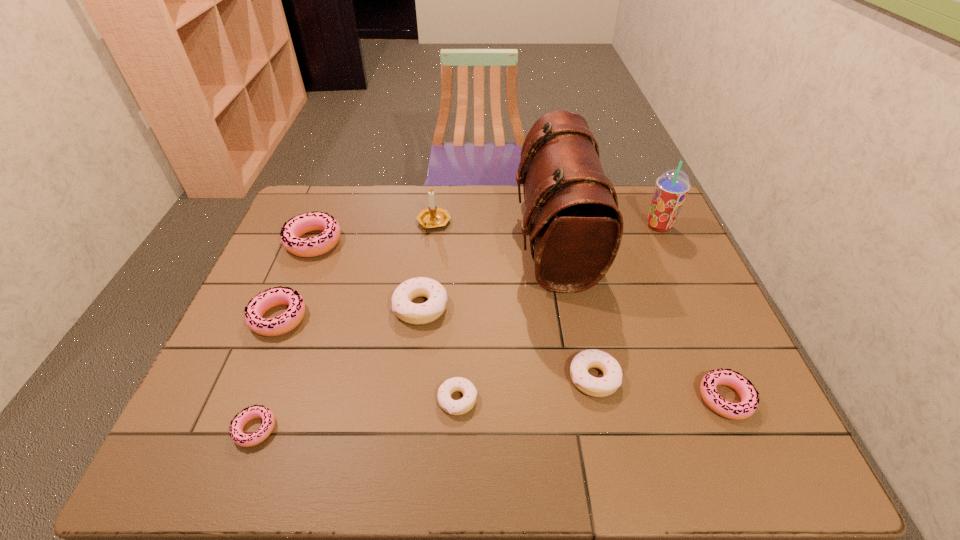
The image size is (960, 540). I want to click on the fourth closest doughnut relative to the rightmost pink doughnut, so click(x=256, y=411).

Identify the location of the fourth closest doughnut to the farthest doughnut. The image size is (960, 540). (454, 407).

In order to click on pink doughnut that is the closest to the farthest doughnut in this screenshot , I will do `click(260, 304)`.

Select which pink doughnut is the third closest to the second biggest pink doughnut. Please provide its 2D coordinates. Your answer should be formatted as a tuple, i.e. [(x, y)], where the tuple contains the x and y coordinates of a point satisfying the conditions above.

[(749, 402)]

Identify which white doughnut is the third nearest to the smallest pink doughnut. Please provide its 2D coordinates. Your answer should be formatted as a tuple, i.e. [(x, y)], where the tuple contains the x and y coordinates of a point satisfying the conditions above.

[(597, 387)]

Point out which white doughnut is positioned as the nearest to the eighth shortest object. Please provide its 2D coordinates. Your answer should be formatted as a tuple, i.e. [(x, y)], where the tuple contains the x and y coordinates of a point satisfying the conditions above.

[(417, 314)]

Locate an element on the screen. free space that satisfies the following two spatial constraints: 1. on the front-facing side of the satchel; 2. on the back side of the third biggest pink doughnut is located at coordinates (584, 399).

Find the location of a particular element. The width and height of the screenshot is (960, 540). vacant region that satisfies the following two spatial constraints: 1. on the front-facing side of the brown satchel; 2. on the front side of the farthest doughnut is located at coordinates (555, 241).

In order to click on vacant region that satisfies the following two spatial constraints: 1. on the front-facing side of the tallest object; 2. on the front side of the farthest white doughnut in this screenshot , I will do `click(566, 307)`.

Where is `free space that satisfies the following two spatial constraints: 1. on the front side of the rightmost white doughnut; 2. on the left side of the rightmost doughnut`? The height and width of the screenshot is (540, 960). free space that satisfies the following two spatial constraints: 1. on the front side of the rightmost white doughnut; 2. on the left side of the rightmost doughnut is located at coordinates (599, 399).